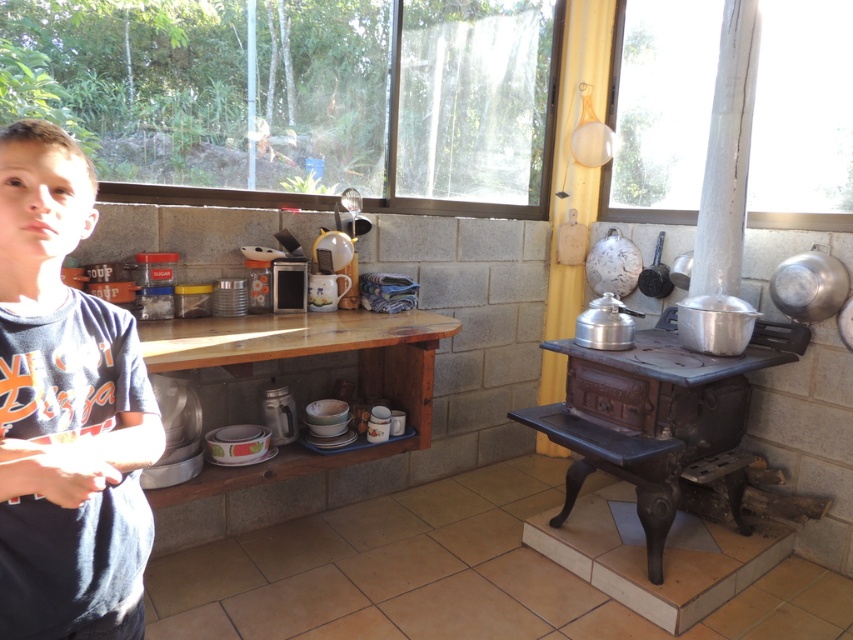
Question: Can you confirm if transparent glass window at upper center is thinner than dark blue t-shirt at left?

Choices:
 (A) yes
 (B) no

Answer: (B)

Question: Is the position of transparent glass window at upper center more distant than that of dark blue t-shirt at left?

Choices:
 (A) no
 (B) yes

Answer: (B)

Question: Estimate the real-world distances between objects in this image. Which object is farther from the rustic cast iron stove at right?

Choices:
 (A) dark blue t-shirt at left
 (B) transparent glass window at upper right
 (C) transparent glass window at upper center

Answer: (A)

Question: Considering the real-world distances, which object is farthest from the rustic cast iron stove at right?

Choices:
 (A) transparent glass window at upper center
 (B) transparent glass window at upper right
 (C) dark blue t-shirt at left

Answer: (C)

Question: Based on their relative distances, which object is nearer to the dark blue t-shirt at left?

Choices:
 (A) transparent glass window at upper center
 (B) rustic cast iron stove at right
 (C) transparent glass window at upper right

Answer: (A)

Question: Does transparent glass window at upper center appear on the right side of rustic cast iron stove at right?

Choices:
 (A) yes
 (B) no

Answer: (B)